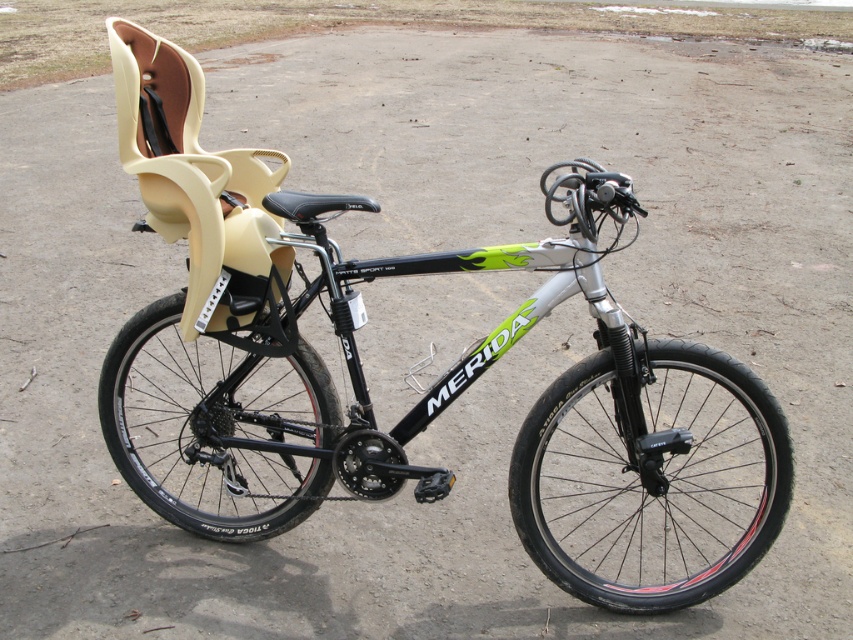
Measure the distance between black rubber tire at lower right and camera.

6.80 feet

Is point (646, 385) positioned after point (157, 305)?

No, it is in front of (157, 305).

The height and width of the screenshot is (640, 853). What are the coordinates of `black rubber tire at lower right` in the screenshot? It's located at (648, 483).